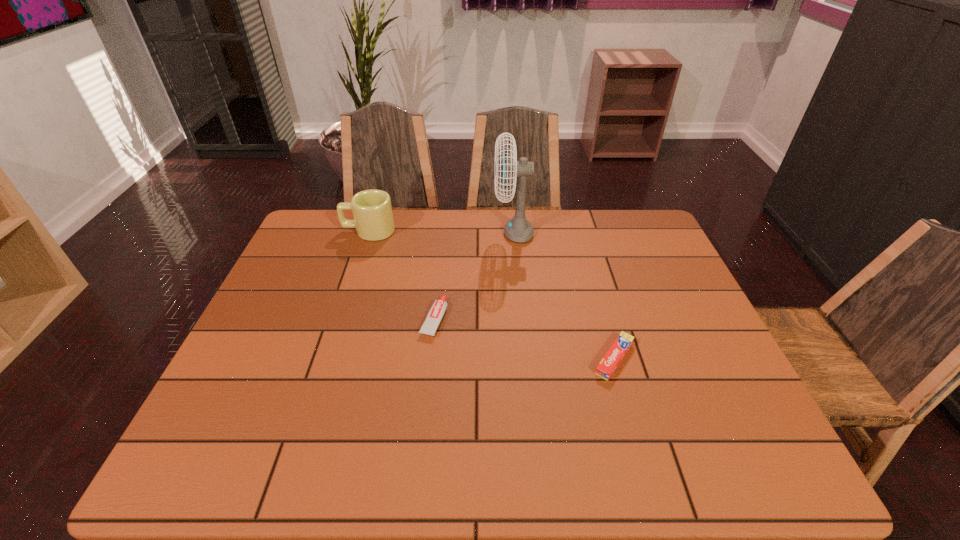
Where is `free point between the mug and the third object from left to right`? free point between the mug and the third object from left to right is located at coordinates [441, 232].

Where is `vacant region between the right toothpaste and the second object from left to right`? Image resolution: width=960 pixels, height=540 pixels. vacant region between the right toothpaste and the second object from left to right is located at coordinates (524, 339).

Find the location of a particular element. free space between the second tallest object and the second object from left to right is located at coordinates click(401, 275).

Find the location of `vacant region between the tallest object and the mug`. vacant region between the tallest object and the mug is located at coordinates (441, 232).

Locate an element on the screen. vacant space in between the fan and the left toothpaste is located at coordinates (473, 276).

Image resolution: width=960 pixels, height=540 pixels. I want to click on object that can be found as the second closest to the shorter toothpaste, so click(518, 229).

Select which object is the second closest to the leftmost object. Please provide its 2D coordinates. Your answer should be formatted as a tuple, i.e. [(x, y)], where the tuple contains the x and y coordinates of a point satisfying the conditions above.

[(518, 229)]

This screenshot has height=540, width=960. What are the coordinates of `vacant space that satisfies the following two spatial constraints: 1. with the handle on the side of the right toothpaste; 2. on the left side of the leftmost object` in the screenshot? It's located at (326, 359).

Identify the location of free location that satisfies the following two spatial constraints: 1. on the back side of the shortest object; 2. on the front-facing side of the second object from right to left. (578, 232).

Image resolution: width=960 pixels, height=540 pixels. Find the location of `vacant space that satisfies the following two spatial constraints: 1. with the handle on the side of the mug; 2. on the right side of the shortest object`. vacant space that satisfies the following two spatial constraints: 1. with the handle on the side of the mug; 2. on the right side of the shortest object is located at coordinates (326, 359).